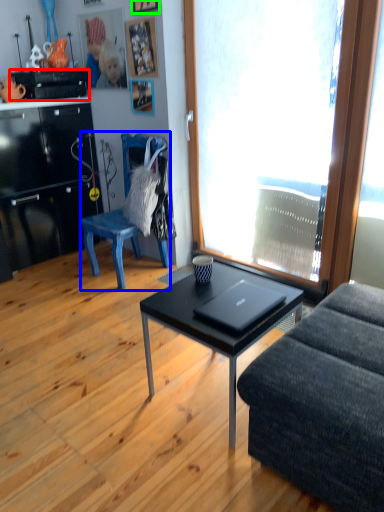
Question: Based on their relative distances, which object is nearer to appliance (highlighted by a red box)? Choose from chair (highlighted by a blue box) and picture frame (highlighted by a green box).

Choices:
 (A) chair
 (B) picture frame

Answer: (B)